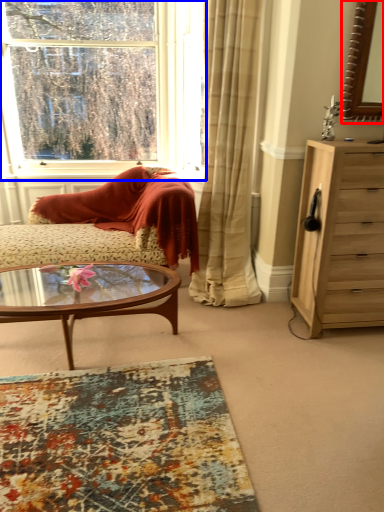
Question: Which of the following is the farthest to the observer, mirror (highlighted by a red box) or window (highlighted by a blue box)?

Choices:
 (A) mirror
 (B) window

Answer: (B)